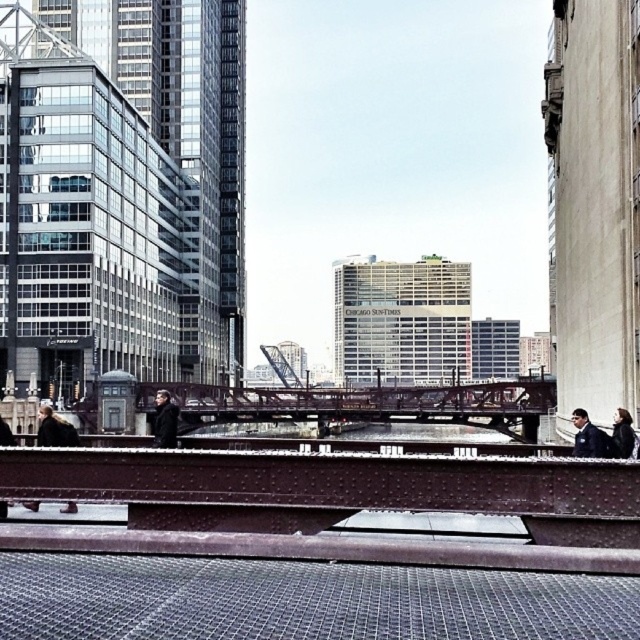
Does point (8, 502) come closer to viewer compared to point (600, 435)?

Yes, point (8, 502) is in front of point (600, 435).

Consider the image. Does metallic steel bench at lower left have a greater height compared to dark blue jacket at right?

Incorrect, metallic steel bench at lower left's height is not larger of dark blue jacket at right's.

Does point (72, 522) come farther from viewer compared to point (593, 451)?

That is False.

This screenshot has width=640, height=640. In order to click on metallic steel bench at lower left in this screenshot , I will do `click(68, 513)`.

Does dark blue jacket at right lie behind black matte jacket at right?

No, it is in front of black matte jacket at right.

Between dark blue jacket at right and black matte jacket at right, which one appears on the left side from the viewer's perspective?

dark blue jacket at right is more to the left.

Measure the distance between point (600, 456) and camera.

Point (600, 456) is 17.71 meters from camera.

The height and width of the screenshot is (640, 640). What are the coordinates of `dark blue jacket at right` in the screenshot? It's located at (588, 436).

Is metallic steel bench at lower left taller than dark brown leather jacket at center?

Incorrect, metallic steel bench at lower left's height is not larger of dark brown leather jacket at center's.

Can you confirm if metallic steel bench at lower left is positioned below dark brown leather jacket at center?

Indeed, metallic steel bench at lower left is positioned under dark brown leather jacket at center.

Locate an element on the screen. Image resolution: width=640 pixels, height=640 pixels. metallic steel bench at lower left is located at coordinates (68, 513).